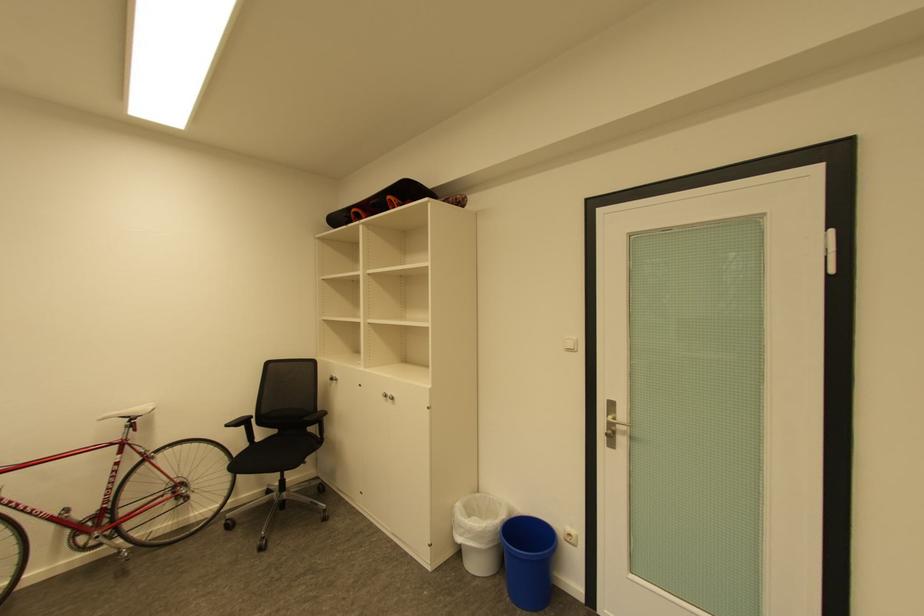
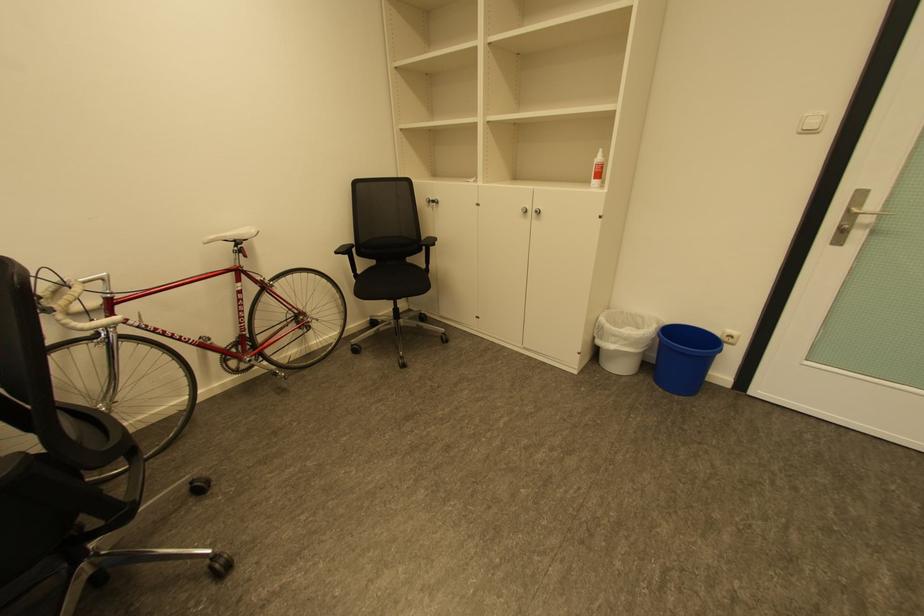
Where in the second image is the point corresponding to point 320,430 from the first image?

(426, 259)